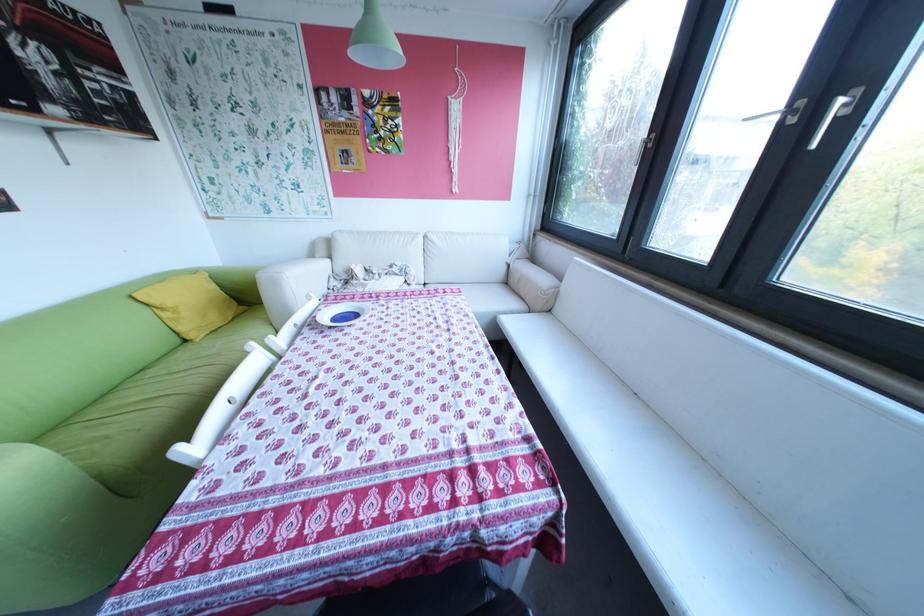
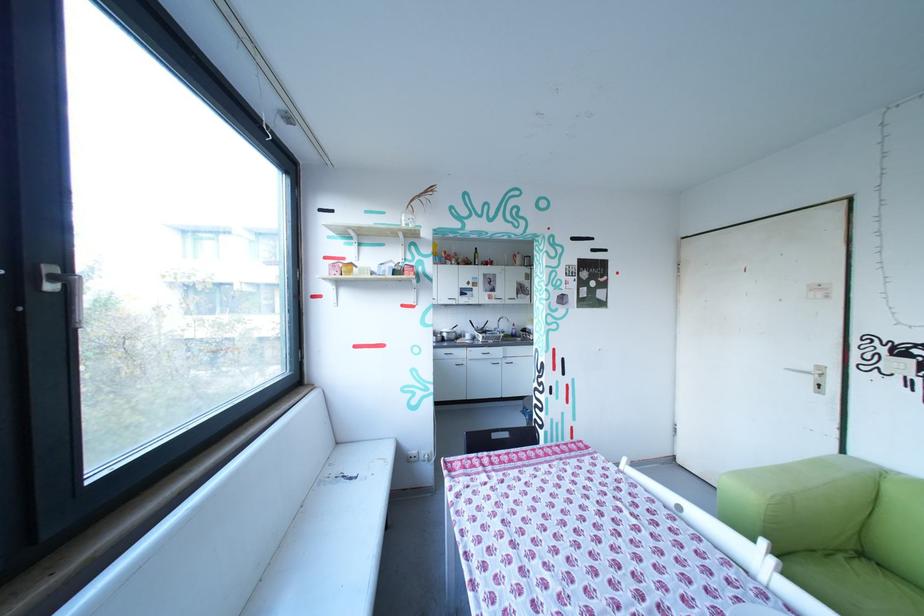
Find the pixel in the second image that matches pixel 284 338 in the first image.

(785, 562)